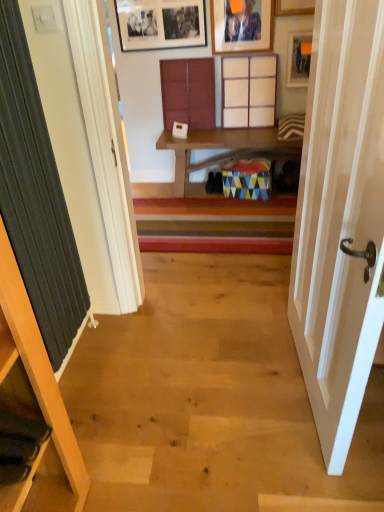
Question: Does point (130, 31) appear closer or farther from the camera than point (364, 338)?

Choices:
 (A) farther
 (B) closer

Answer: (A)

Question: Considering the positions of black matte picture frame at upper center, marked as the 3th picture frame in a right-to-left arrangement, and white wood door at right in the image, is black matte picture frame at upper center, marked as the 3th picture frame in a right-to-left arrangement, wider or thinner than white wood door at right?

Choices:
 (A) wide
 (B) thin

Answer: (B)

Question: Which object is the farthest from the wooden cabinet at lower left, which appears as the 1th cabinet when viewed from the front?

Choices:
 (A) matte wooden picture frame at upper center, arranged as the second picture frame when viewed from the right
 (B) wooden shelf at center
 (C) matte wood cabinet at center, which is the 2th cabinet from right to left
 (D) white wood door at right
 (E) wooden cabinet at upper center, which appears as the first cabinet when viewed from the right

Answer: (A)

Question: Which is nearer to the wooden shelf at center?

Choices:
 (A) wooden cabinet at lower left, positioned as the 3th cabinet in right-to-left order
 (B) dark grey ribbed curtain at left
 (C) matte wood cabinet at center, which is the 2th cabinet from right to left
 (D) matte wooden picture frame at upper center, arranged as the second picture frame when viewed from the right
 (E) wooden cabinet at upper center, which appears as the first cabinet when viewed from the right

Answer: (E)